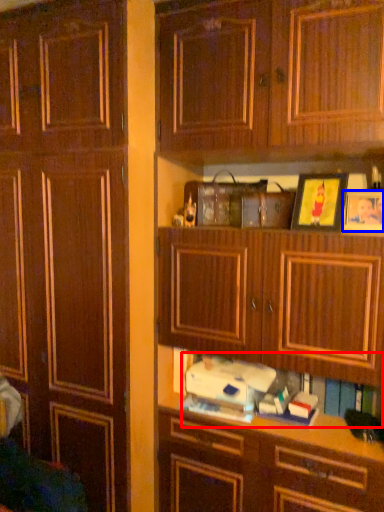
Question: Which point is closer to the camera, book (highlighted by a red box) or picture frame (highlighted by a blue box)?

Choices:
 (A) book
 (B) picture frame

Answer: (B)